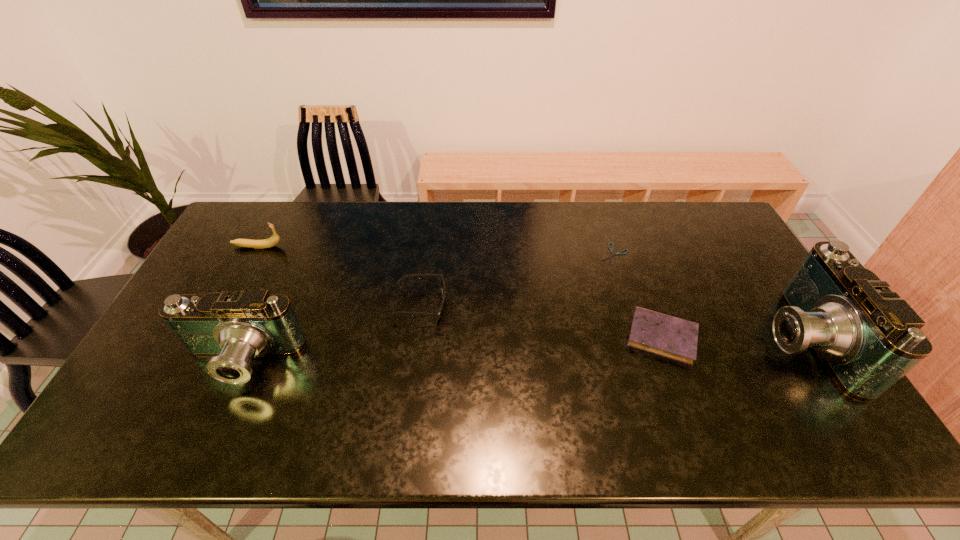
This screenshot has height=540, width=960. Find the location of `free spot between the left camcorder and the shears`. free spot between the left camcorder and the shears is located at coordinates (427, 308).

Where is `free space between the second tallest object and the shears`? Image resolution: width=960 pixels, height=540 pixels. free space between the second tallest object and the shears is located at coordinates (427, 308).

Identify the location of free space between the taller camcorder and the sunglasses. Image resolution: width=960 pixels, height=540 pixels. (611, 322).

The height and width of the screenshot is (540, 960). Find the location of `unoccupied position between the second shortest object and the second tallest object`. unoccupied position between the second shortest object and the second tallest object is located at coordinates (451, 349).

Find the location of `free space between the diary and the tallest object`. free space between the diary and the tallest object is located at coordinates (732, 339).

At what (x,y) coordinates should I click in order to perform the action: click on vacant region between the banana and the shears. Please return your answer as a coordinate pair (x, y). The image size is (960, 540). Looking at the image, I should click on (436, 250).

At what (x,y) coordinates should I click in order to perform the action: click on object that ranks as the fifth closest to the second tallest object. Please return your answer as a coordinate pair (x, y). The image size is (960, 540). Looking at the image, I should click on 868,338.

Identify which object is the second closest to the shorter camcorder. Please provide its 2D coordinates. Your answer should be formatted as a tuple, i.e. [(x, y)], where the tuple contains the x and y coordinates of a point satisfying the conditions above.

[(274, 239)]

Where is `free location that satisfies the following two spatial constraints: 1. at the stem of the diary; 2. on the left side of the banana`? free location that satisfies the following two spatial constraints: 1. at the stem of the diary; 2. on the left side of the banana is located at coordinates click(208, 337).